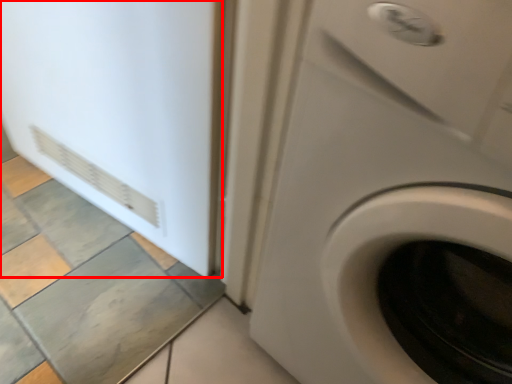
Question: From the image's perspective, considering the relative positions of screen door (annotated by the red box) and washing machine in the image provided, where is screen door (annotated by the red box) located with respect to the staircase?

Choices:
 (A) below
 (B) above

Answer: (B)